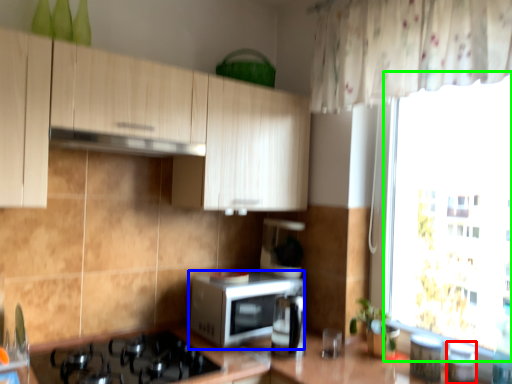
Question: Which object is positioned farthest from appliance (highlighted by a red box)? Select from microwave oven (highlighted by a blue box) and window screen (highlighted by a green box).

Choices:
 (A) microwave oven
 (B) window screen

Answer: (B)